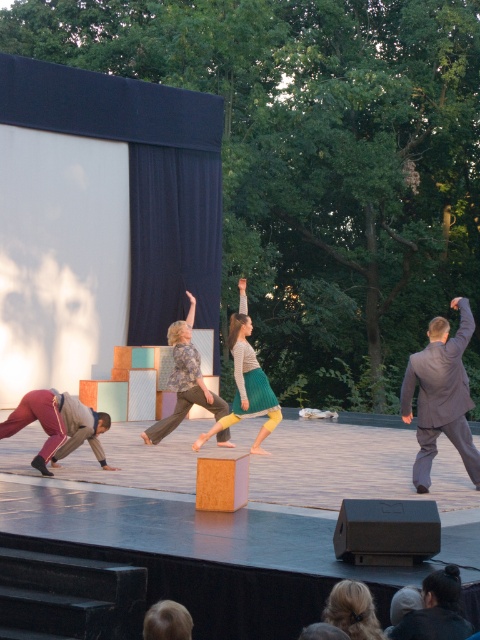
Does patterned fabric pants at center have a smaller size compared to dark gray knit hat at lower right?

No.

Where is `patterned fabric pants at center`? patterned fabric pants at center is located at coordinates (184, 380).

Identify the location of patterned fabric pants at center. The width and height of the screenshot is (480, 640). (184, 380).

Does dark gray suit at right have a lesser height compared to maroon fabric pants at left?

Yes.

Between dark gray suit at right and maroon fabric pants at left, which one appears on the right side from the viewer's perspective?

dark gray suit at right is more to the right.

Between point (415, 378) and point (54, 452), which one is positioned in front?

Positioned in front is point (415, 378).

Locate an element on the screen. The height and width of the screenshot is (640, 480). dark gray suit at right is located at coordinates (441, 396).

Can you confirm if maroon fabric pants at left is taller than patterned fabric pants at center?

In fact, maroon fabric pants at left may be shorter than patterned fabric pants at center.

Between maroon fabric pants at left and patterned fabric pants at center, which one is positioned higher?

patterned fabric pants at center is higher up.

Which is behind, point (87, 413) or point (211, 397)?

Positioned behind is point (211, 397).

Find the location of a particular element. maroon fabric pants at left is located at coordinates (59, 426).